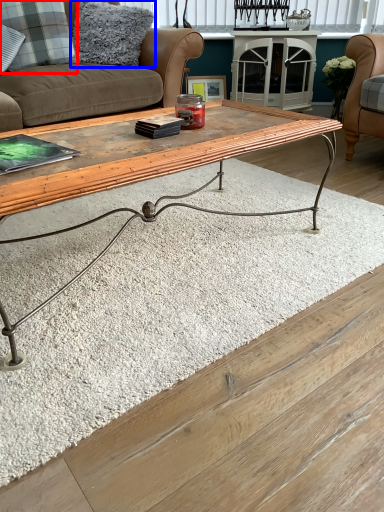
Question: Which point is further to the camera, pillow (highlighted by a red box) or pillow (highlighted by a blue box)?

Choices:
 (A) pillow
 (B) pillow

Answer: (B)